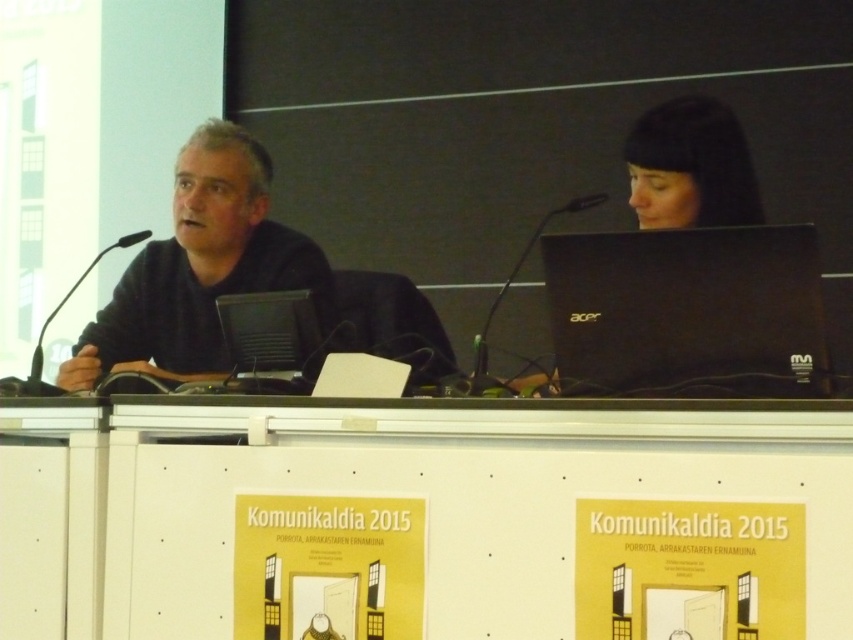
Is point (672, 193) closer to camera compared to point (39, 330)?

Yes, point (672, 193) is in front of point (39, 330).

Is black matte hair at upper center in front of black plastic microphone at left?

Yes, black matte hair at upper center is in front of black plastic microphone at left.

Which is behind, point (633, 177) or point (35, 348)?

The point (35, 348) is more distant.

The image size is (853, 640). I want to click on black matte hair at upper center, so click(689, 166).

Who is higher up, black plastic laptop at center or black plastic microphone at left?

black plastic microphone at left

Who is more distant from viewer, (x=254, y=310) or (x=28, y=380)?

The point (x=254, y=310) is more distant.

Which is in front, point (270, 369) or point (54, 310)?

Point (270, 369) is in front.

At what (x,y) coordinates should I click in order to perform the action: click on black plastic laptop at center. Please return your answer as a coordinate pair (x, y). This screenshot has height=640, width=853. Looking at the image, I should click on (268, 330).

Which is more to the right, black matte shirt at left or black plastic microphone at center?

black plastic microphone at center

At what (x,y) coordinates should I click in order to perform the action: click on black matte shirt at left. Please return your answer as a coordinate pair (x, y). Looking at the image, I should click on (200, 268).